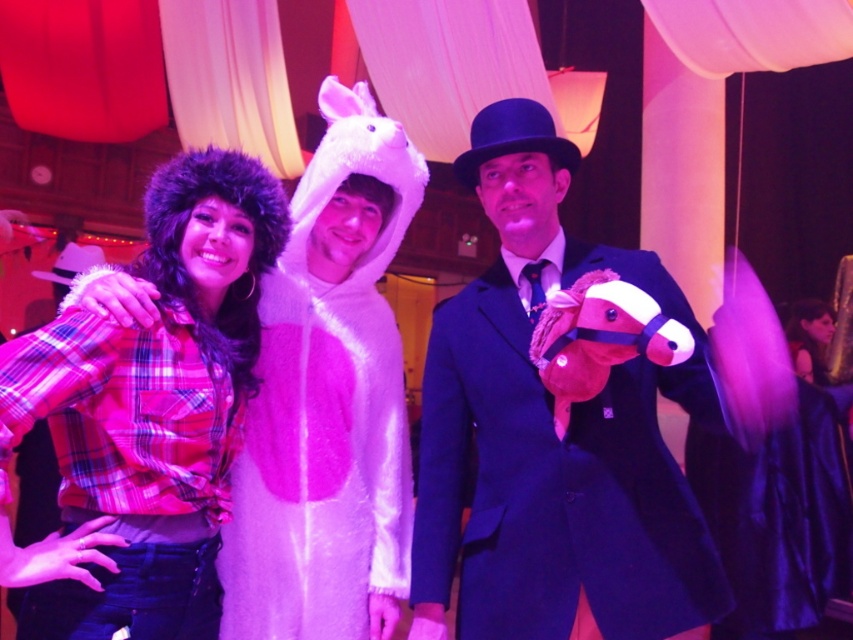
Question: Does velvet blue suit at center come in front of plaid flannel shirt at left?

Choices:
 (A) no
 (B) yes

Answer: (A)

Question: Which of the following is the closest to the observer?

Choices:
 (A) (285, 211)
 (B) (438, 378)

Answer: (A)

Question: Which point is farther from the camera taking this photo?

Choices:
 (A) (548, 467)
 (B) (238, 250)

Answer: (B)

Question: From the image, what is the correct spatial relationship of velvet blue suit at center in relation to plaid flannel shirt at left?

Choices:
 (A) left
 (B) right

Answer: (B)

Question: Does velvet blue suit at center have a greater width compared to plaid flannel shirt at left?

Choices:
 (A) yes
 (B) no

Answer: (A)